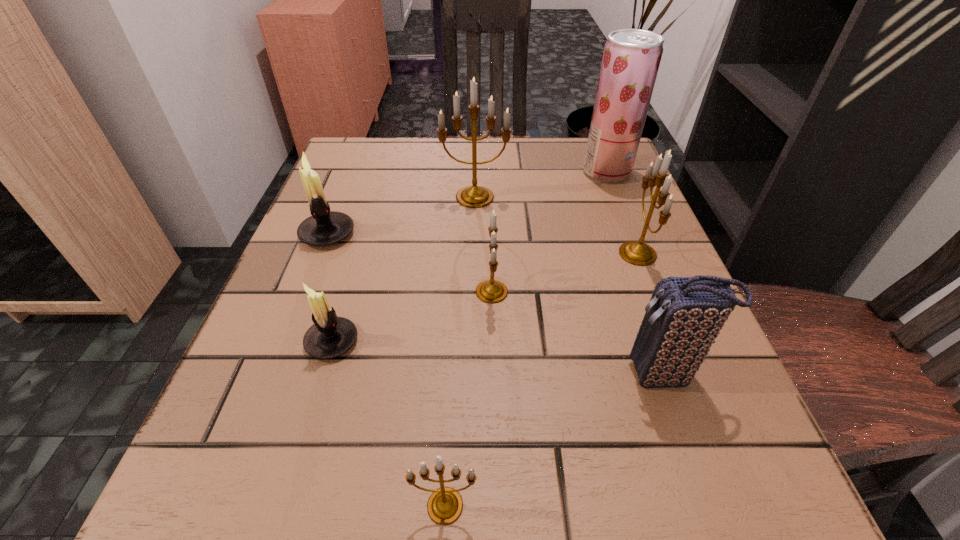
This screenshot has width=960, height=540. I want to click on blank area located on the front of the third biggest gold candelabrum, so click(497, 507).

Find the location of a particular element. Image resolution: width=960 pixels, height=540 pixels. free spot located on the back of the smaller white candle holder is located at coordinates (359, 251).

Locate an element on the screen. The width and height of the screenshot is (960, 540). vacant space located 0.050m on the back of the smallest gold candelabrum is located at coordinates (448, 446).

This screenshot has width=960, height=540. I want to click on fruit juice present at the far edge, so click(631, 58).

Where is `candelabrum located at the far edge`? Image resolution: width=960 pixels, height=540 pixels. candelabrum located at the far edge is located at coordinates (474, 196).

What are the coordinates of `object at the near edge` in the screenshot? It's located at (445, 505).

Where is `fruit juice at the right edge`? The height and width of the screenshot is (540, 960). fruit juice at the right edge is located at coordinates (631, 58).

Locate an element on the screen. candelabrum located in the right edge section of the desktop is located at coordinates (638, 253).

Locate an element on the screen. This screenshot has height=540, width=960. clutch bag positioned at the right edge is located at coordinates (684, 316).

Identify the location of object present at the far right corner. (631, 58).